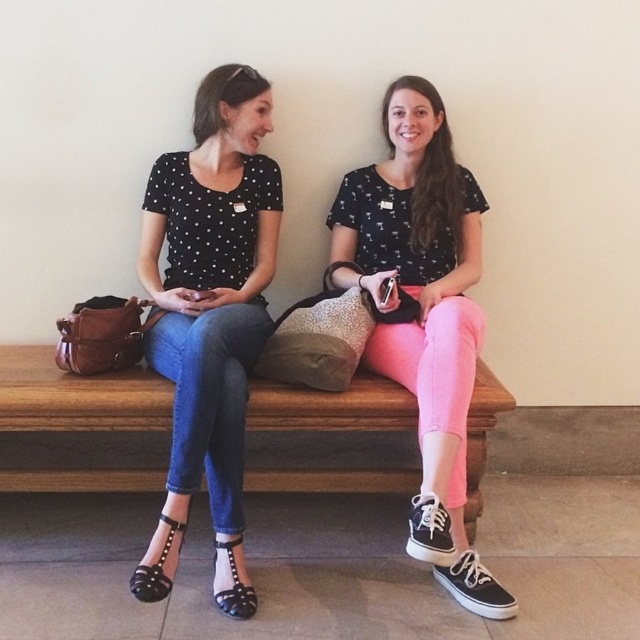
Who is more distant from viewer, (266, 157) or (410, 368)?

The point (266, 157) is more distant.

Locate an element on the screen. The width and height of the screenshot is (640, 640). matte black polka dot blouse at center is located at coordinates (209, 316).

Who is more forward, (147, 358) or (4, 404)?

Point (4, 404) is in front.

Can you confirm if matte black polka dot blouse at center is positioned below wooden bench at center?

No.

Who is more forward, (x=173, y=557) or (x=157, y=472)?

Point (x=173, y=557) is in front.

Find the location of a particular element. This screenshot has height=640, width=640. matte black polka dot blouse at center is located at coordinates (209, 316).

Is point (408, 362) positioned before point (150, 412)?

No, (408, 362) is further to viewer.

In order to click on pink matte pants at center in this screenshot , I will do `click(422, 312)`.